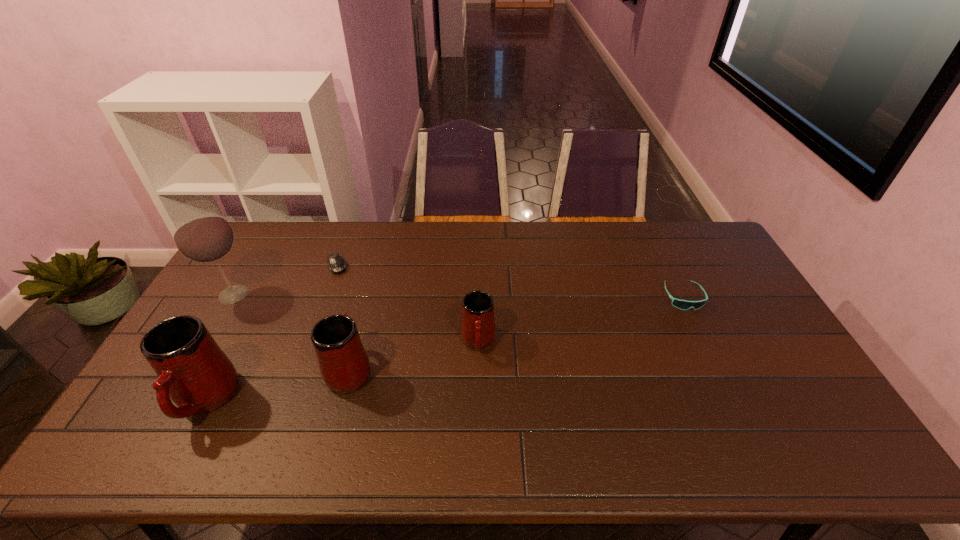
At what (x,y) coordinates should I click in order to perform the action: click on the fifth shortest object. Please return your answer as a coordinate pair (x, y). Looking at the image, I should click on (192, 370).

Locate an element on the screen. Image resolution: width=960 pixels, height=540 pixels. the tallest mug is located at coordinates (192, 370).

This screenshot has height=540, width=960. I want to click on the third object from right to left, so click(344, 366).

In order to click on the fourth shortest object in this screenshot , I will do `click(344, 366)`.

At what (x,y) coordinates should I click in order to perform the action: click on the rightmost mug. Please return your answer as a coordinate pair (x, y). Looking at the image, I should click on (478, 330).

Locate an element on the screen. the second object from right to left is located at coordinates (478, 330).

This screenshot has height=540, width=960. I want to click on the third object from left to right, so click(336, 263).

Find the location of a particular element. The image size is (960, 540). mouse is located at coordinates (336, 263).

The height and width of the screenshot is (540, 960). What are the coordinates of `the rightmost object` in the screenshot? It's located at (680, 304).

Find the location of a particular element. The width and height of the screenshot is (960, 540). the tallest object is located at coordinates (201, 234).